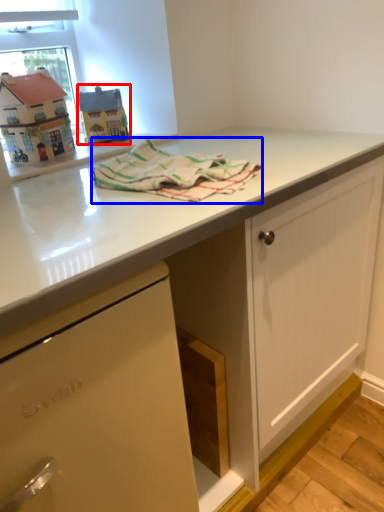
Question: Which object is further to the camera taking this photo, appliance (highlighted by a red box) or bath towel (highlighted by a blue box)?

Choices:
 (A) appliance
 (B) bath towel

Answer: (A)